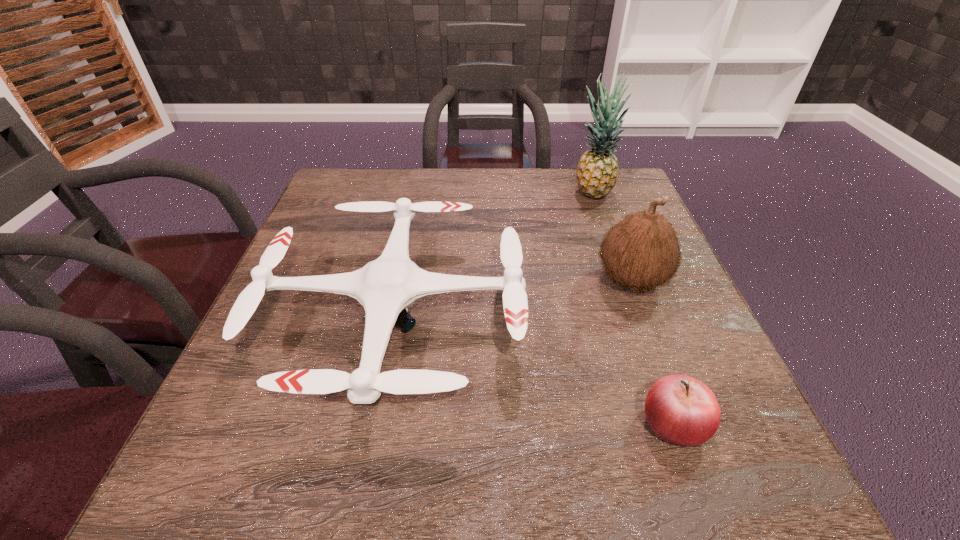
The image size is (960, 540). What are the coordinates of `pineapple` in the screenshot? It's located at (597, 171).

I want to click on the tallest object, so click(597, 171).

The height and width of the screenshot is (540, 960). I want to click on coconut, so click(642, 251).

I want to click on the leftmost object, so (x=385, y=287).

Locate an element on the screen. The height and width of the screenshot is (540, 960). the third tallest object is located at coordinates pyautogui.click(x=385, y=287).

Locate an element on the screen. The height and width of the screenshot is (540, 960). apple is located at coordinates click(x=682, y=410).

Locate an element on the screen. The image size is (960, 540). vacant space located on the front of the pineapple is located at coordinates (623, 284).

What are the coordinates of `blank area located on the surface of the second tallest object` in the screenshot? It's located at (459, 281).

Locate an element on the screen. blank space located on the surface of the second tallest object is located at coordinates (547, 281).

Locate an element on the screen. vacant space located 0.330m on the surface of the second tallest object is located at coordinates (441, 281).